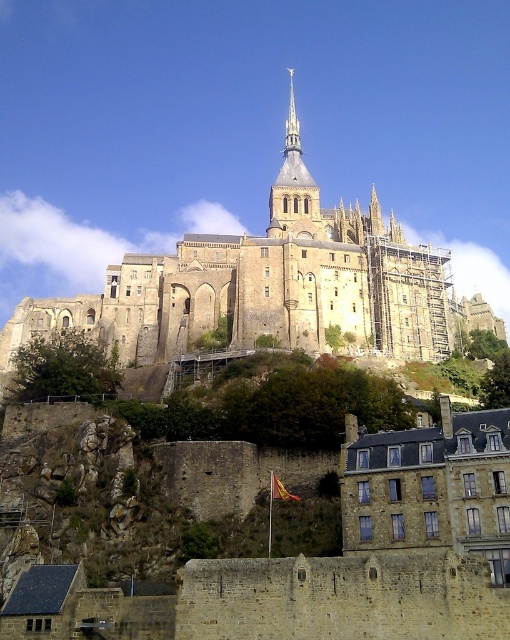
Is brown stone castle at center wider than shiny silver spire at upper center?

Yes, brown stone castle at center is wider than shiny silver spire at upper center.

Does point (410, 307) come behind point (287, 132)?

No, (410, 307) is closer to viewer.

Identify the location of brown stone castle at center. (271, 289).